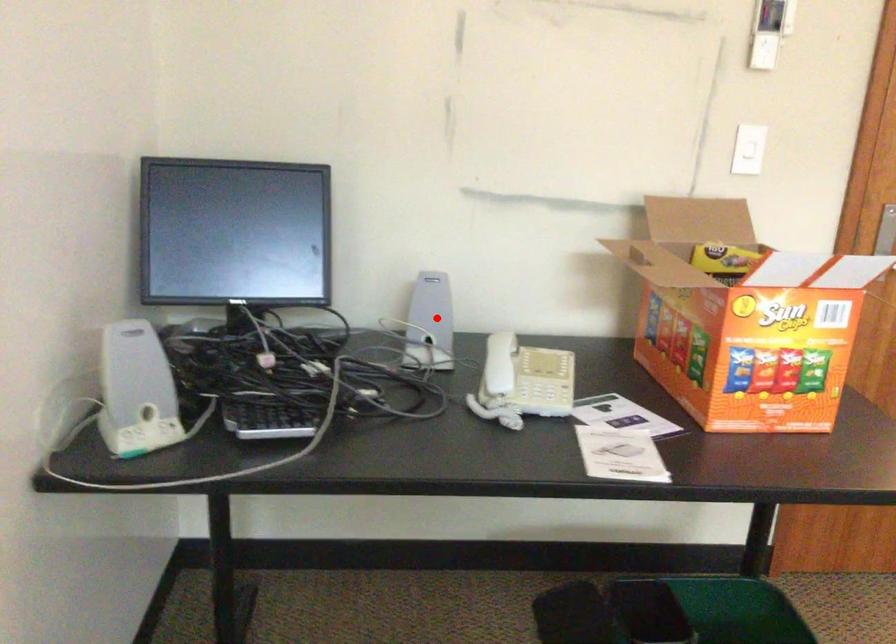
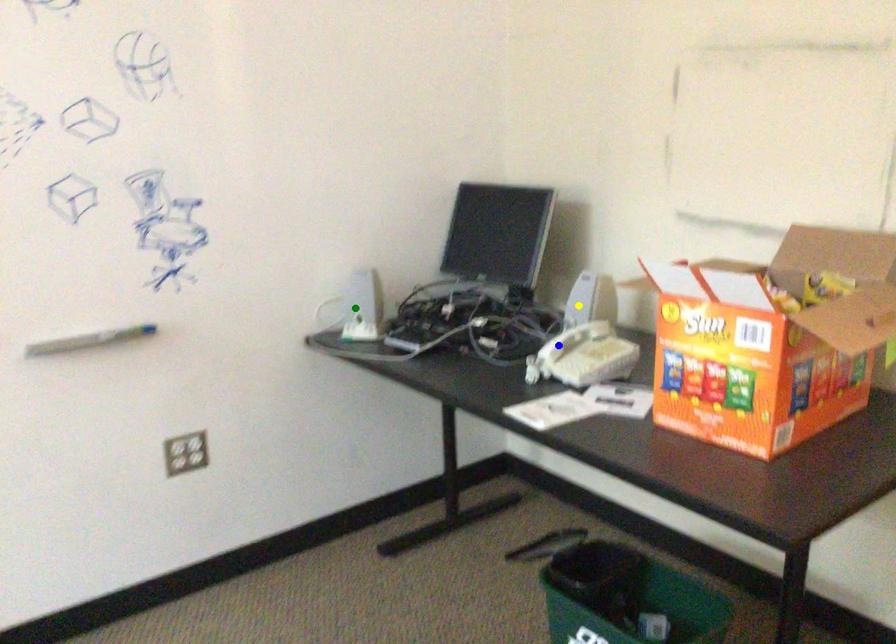
Question: I am providing you with two images of the same scene from different viewpoints. A red point is marked on the first image. You are given multiple points on the second image. Can you choose the point in image 2 that corresponds to the point in image 1?

Choices:
 (A) green point
 (B) yellow point
 (C) blue point

Answer: (B)